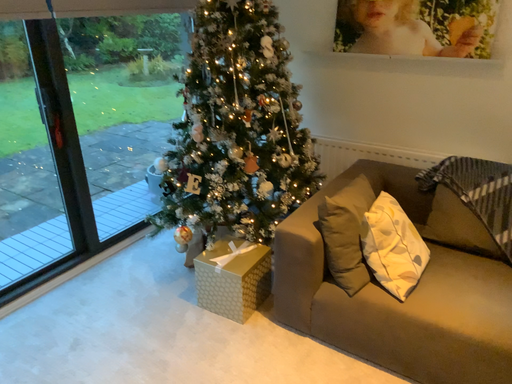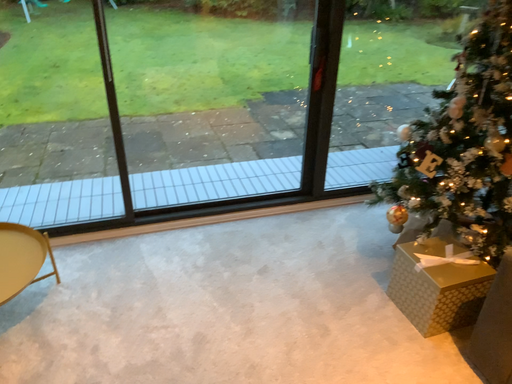
Question: How did the camera likely rotate when shooting the video?

Choices:
 (A) rotated right
 (B) rotated left

Answer: (B)